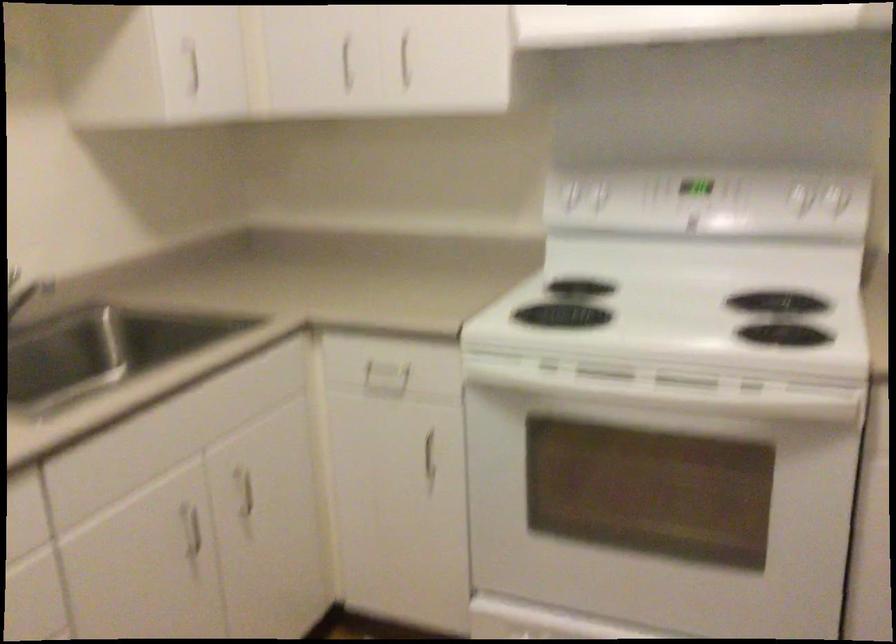
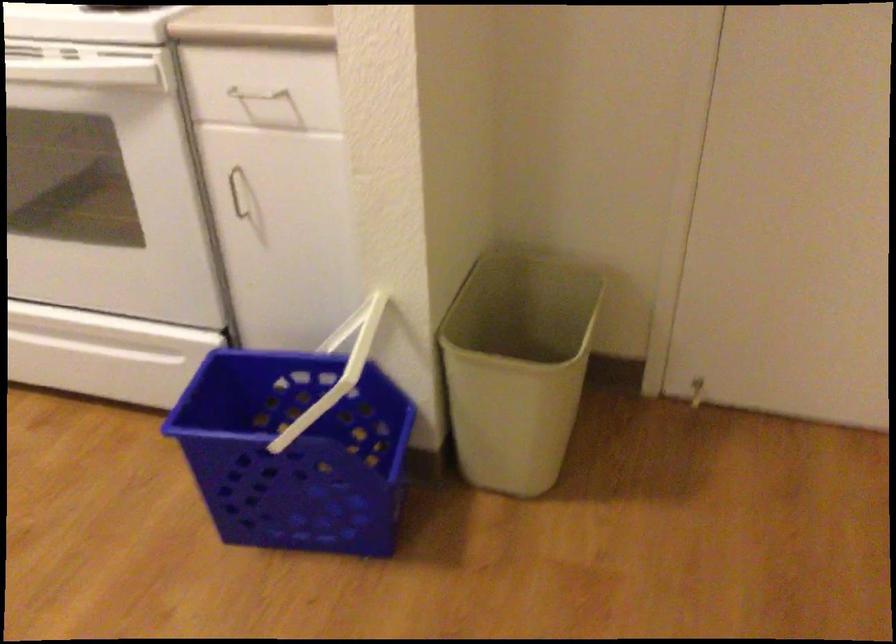
Question: The images are taken continuously from a first-person perspective. In which direction are you moving?

Choices:
 (A) Left
 (B) Right
 (C) Forward
 (D) Backward

Answer: (B)